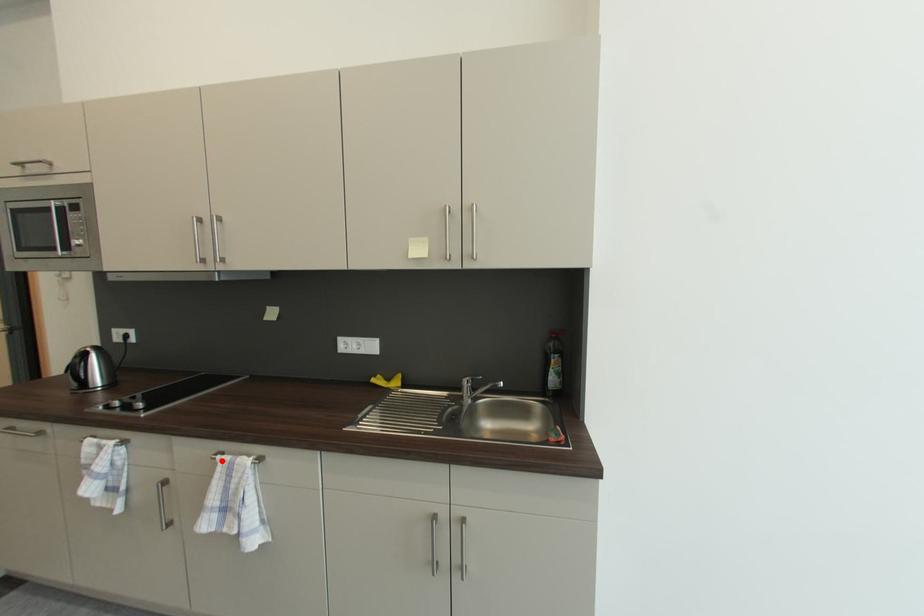
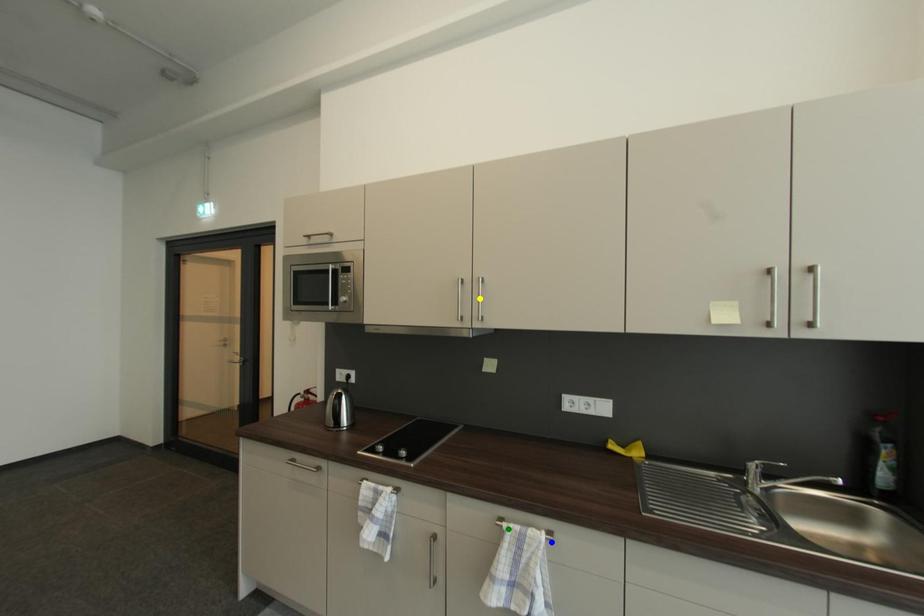
Question: I am providing you with two images of the same scene from different viewpoints. A red point is marked on the first image. You are given multiple points on the second image. Can you choose the point in image 2 that corresponds to the point in image 1?

Choices:
 (A) blue point
 (B) green point
 (C) yellow point

Answer: (B)